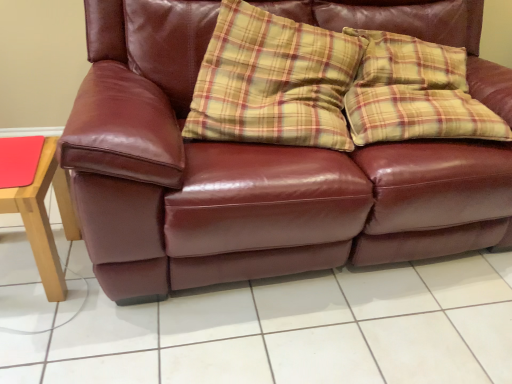
In order to click on free space in front of matte wood table at left in this screenshot , I will do `click(36, 336)`.